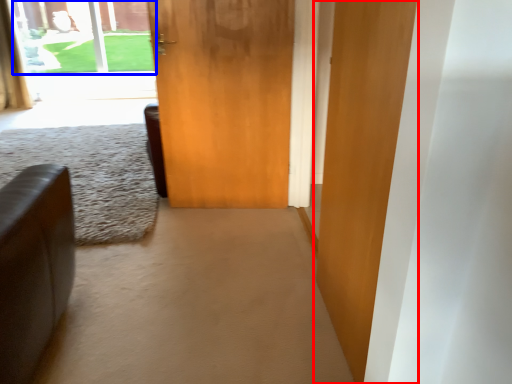
Question: Which point is further to the camera, door (highlighted by a red box) or window screen (highlighted by a blue box)?

Choices:
 (A) door
 (B) window screen

Answer: (B)